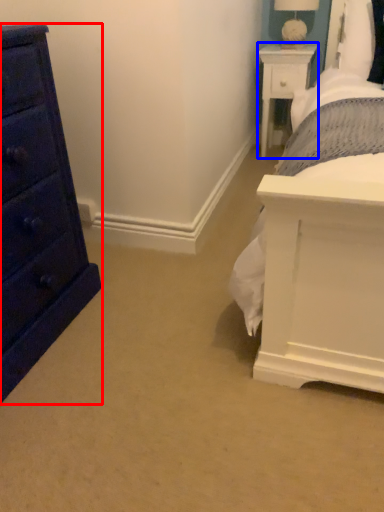
Question: Among these objects, which one is nearest to the camera, chest of drawers (highlighted by a red box) or nightstand (highlighted by a blue box)?

Choices:
 (A) chest of drawers
 (B) nightstand

Answer: (A)